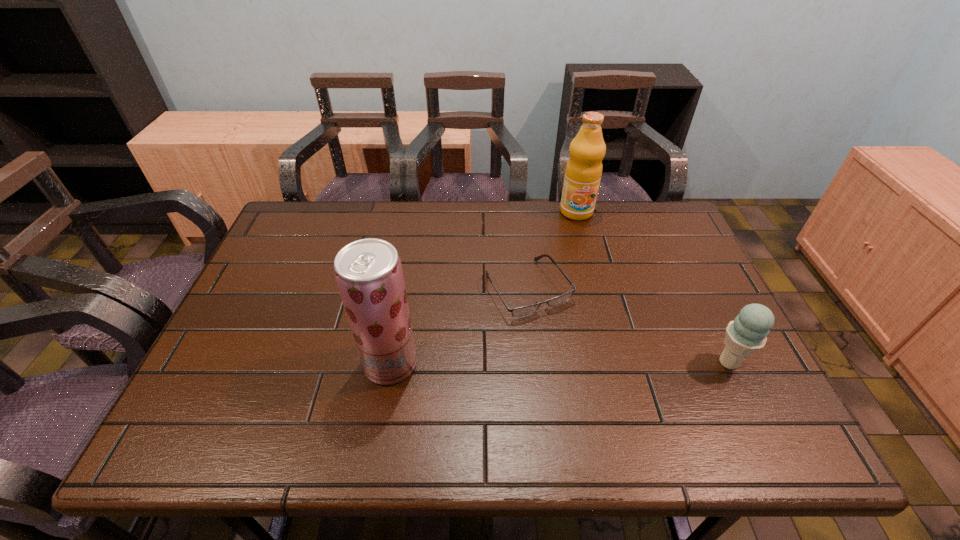
Where is `free space located 0.180m on the front label of the farther fruit juice`? free space located 0.180m on the front label of the farther fruit juice is located at coordinates (587, 259).

Locate an element on the screen. This screenshot has width=960, height=540. vacant area situated 0.120m on the front label of the farther fruit juice is located at coordinates (584, 246).

Locate an element on the screen. The image size is (960, 540). vacant space located 0.180m on the front label of the farther fruit juice is located at coordinates (587, 259).

Identify the location of vacant space located on the front-facing side of the third nearest object. (600, 393).

Where is `blank space located 0.190m on the front-facing side of the third nearest object`? blank space located 0.190m on the front-facing side of the third nearest object is located at coordinates (590, 378).

Image resolution: width=960 pixels, height=540 pixels. I want to click on vacant space situated 0.130m on the front-facing side of the third nearest object, so click(576, 358).

Locate an element on the screen. object present at the far edge is located at coordinates (583, 172).

This screenshot has height=540, width=960. I want to click on fruit juice situated at the near edge, so click(368, 272).

The image size is (960, 540). I want to click on ice cream situated at the near edge, so click(747, 334).

You are a GUI agent. You are given a task and a screenshot of the screen. Output one action in this format:
    pyautogui.click(x=<x>, y=<y>)
    Task: Click on the object situated at the right edge
    Image resolution: width=960 pixels, height=540 pixels.
    Given the screenshot: What is the action you would take?
    pyautogui.click(x=747, y=334)